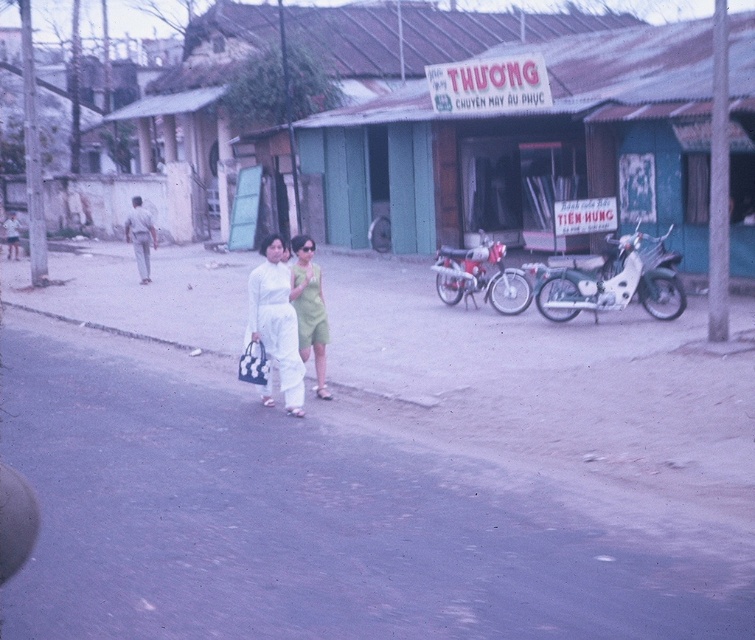
You are standing at the point marked by the coordinates point (264, 278) and want to walk to the point marked by point (512, 301). Given that you can only move along the paved road visible in the foreground, which direction should you face to start moving towards your destination?

Since point (264, 278) is closer to the viewer than point (512, 301), you should face away from the viewer to start moving along the paved road towards your destination.

You are a delivery person who needs to park your motorcycle between the white matte motorcycle at right and the metallic red motorcycle at center. Is there enough space for your motorcycle which is 1.5 meters wide?

The white matte motorcycle at right is positioned on the right side of metallic red motorcycle at center, so there is space between them. However, the exact width between them is not specified, so it is uncertain if it can accommodate a 1.5 meter wide motorcycle.

You are a photographer positioned at the edge of the road. You want to capture a clear photo of the white matte dress at center without the metallic red motorcycle at center blocking it. Is this possible based on their positions?

The white matte dress at center is in front of the metallic red motorcycle at center, so it is blocking the motorcycle. Therefore, you cannot capture a clear photo of the white matte dress at center without the motorcycle being in the frame.